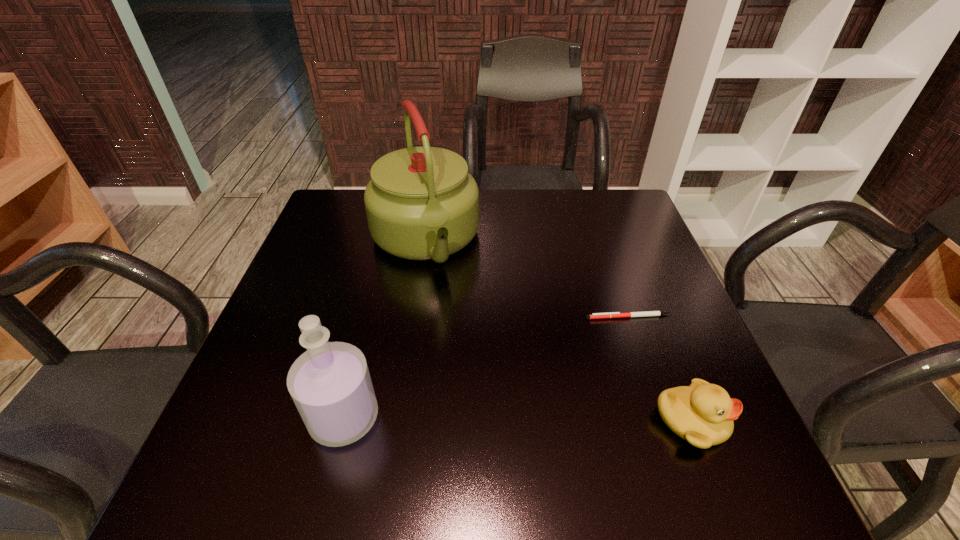
This screenshot has width=960, height=540. In order to click on perfume in this screenshot , I will do `click(330, 384)`.

The height and width of the screenshot is (540, 960). In order to click on duckling in this screenshot , I will do `click(702, 414)`.

Locate an element on the screen. Image resolution: width=960 pixels, height=540 pixels. the farthest object is located at coordinates (421, 203).

The image size is (960, 540). In order to click on kettle in this screenshot , I will do `click(421, 203)`.

At what (x,y) coordinates should I click in order to perform the action: click on pen. Please return your answer as a coordinate pair (x, y). Looking at the image, I should click on (647, 313).

Locate an element on the screen. Image resolution: width=960 pixels, height=540 pixels. the shortest object is located at coordinates (647, 313).

This screenshot has height=540, width=960. I want to click on vacant space located on the right of the perfume, so click(x=458, y=417).

Find the location of `free region located at the spout of the farthest object`. free region located at the spout of the farthest object is located at coordinates (446, 313).

At what (x,y) coordinates should I click in order to perform the action: click on vacant area situated 0.060m at the spout of the farthest object. Please return your answer as a coordinate pair (x, y). This screenshot has height=540, width=960. Looking at the image, I should click on (444, 304).

Where is `vacant point located at the spout of the farthest object`? This screenshot has width=960, height=540. vacant point located at the spout of the farthest object is located at coordinates (454, 333).